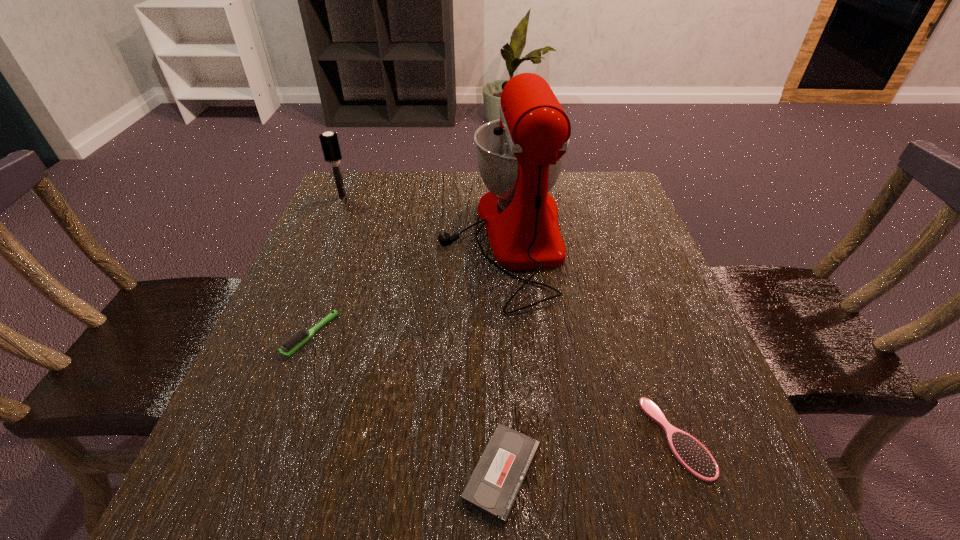
The width and height of the screenshot is (960, 540). I want to click on object that is at the far left corner, so (329, 141).

I want to click on object that is at the near right corner, so click(x=693, y=456).

Where is `vacant space at the far edge of the desktop`? vacant space at the far edge of the desktop is located at coordinates (405, 187).

Identify the location of vacant space at the near edge of the desktop. This screenshot has height=540, width=960. [x=385, y=476].

Where is `free space at the left edge`? The height and width of the screenshot is (540, 960). free space at the left edge is located at coordinates click(273, 313).

I want to click on vacant space at the right edge of the desktop, so click(x=691, y=380).

This screenshot has height=540, width=960. Identify the location of vacant region at the far left corner of the desktop. (375, 195).

Locate an element on the screen. Image resolution: width=960 pixels, height=540 pixels. free point at the far right corner is located at coordinates (578, 198).

Find the location of a particular element. The height and width of the screenshot is (540, 960). free space between the second tallest hairbrush and the rightmost object is located at coordinates (494, 387).

Image resolution: width=960 pixels, height=540 pixels. I want to click on free spot between the shortest hairbrush and the tallest object, so click(x=589, y=338).